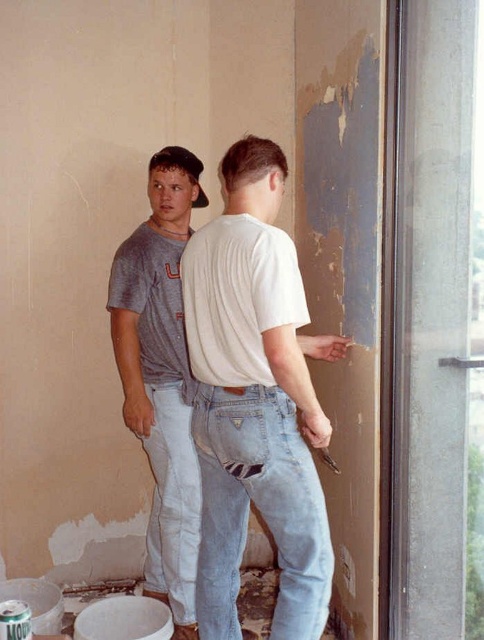
Can you confirm if white matte t-shirt at center is wider than gray cotton t-shirt at left?

Yes.

Does point (229, 577) come closer to viewer compared to point (150, 216)?

That is True.

Which is in front, point (286, 284) or point (183, 188)?

Point (286, 284)

Find the location of a particular element. The width and height of the screenshot is (484, 640). white matte t-shirt at center is located at coordinates (256, 401).